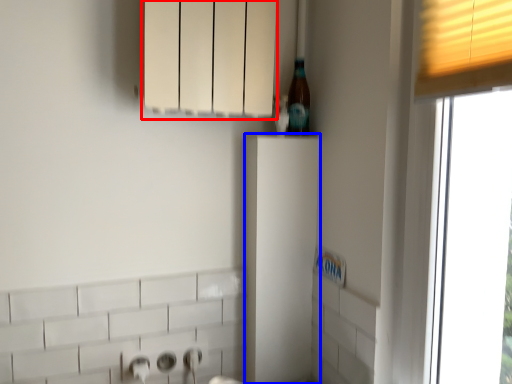
Question: Among these objects, which one is nearest to the camera, cabinetry (highlighted by a red box) or cabinetry (highlighted by a blue box)?

Choices:
 (A) cabinetry
 (B) cabinetry

Answer: (A)